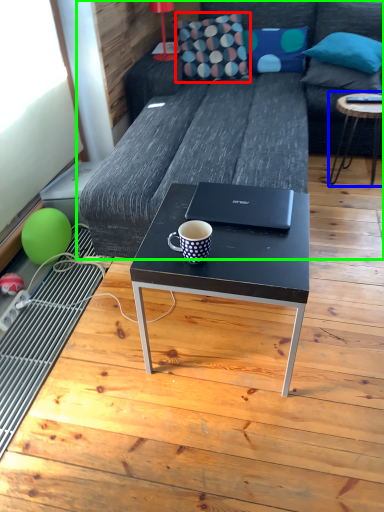
Question: Estimate the real-world distances between objects in this image. Which object is farther from throw pillow (highlighted by a red box), table (highlighted by a blue box) or studio couch (highlighted by a green box)?

Choices:
 (A) table
 (B) studio couch

Answer: (A)